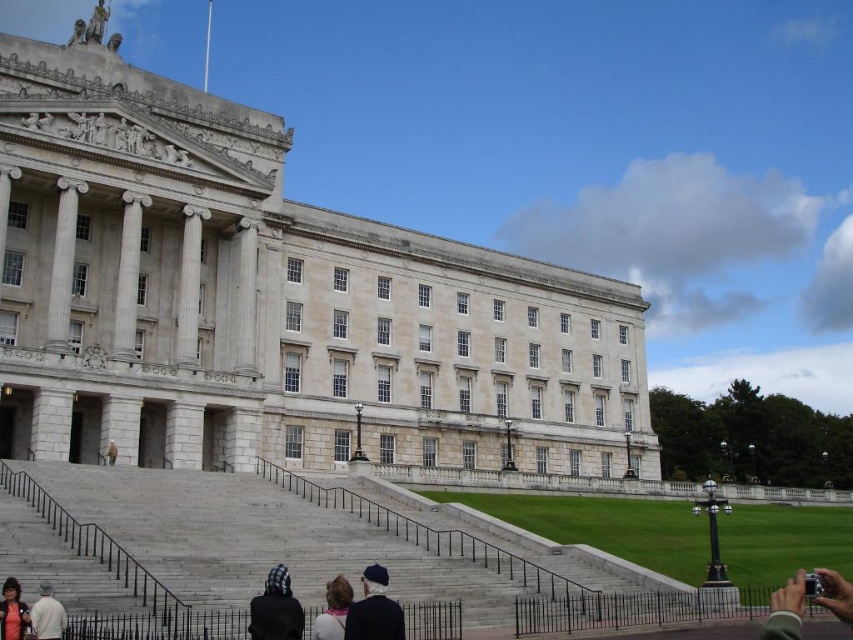
Question: Can you confirm if white stone building at center is wider than black knit cap at lower center?

Choices:
 (A) no
 (B) yes

Answer: (B)

Question: Can you confirm if white stone building at center is positioned to the right of black knit cap at lower center?

Choices:
 (A) no
 (B) yes

Answer: (B)

Question: Is the position of black knit cap at lower center less distant than that of white cotton shirt at lower left?

Choices:
 (A) no
 (B) yes

Answer: (B)

Question: Which point appears closest to the camera in this image?

Choices:
 (A) (9, 579)
 (B) (109, 442)
 (C) (430, 420)
 (D) (833, 584)

Answer: (D)

Question: Which point is closer to the camera taking this photo?

Choices:
 (A) (329, 509)
 (B) (6, 77)

Answer: (A)

Question: Which is farther from the gray stone stairs at lower left?

Choices:
 (A) light brown hair at lower center
 (B) dark blue knit cap at lower center

Answer: (B)